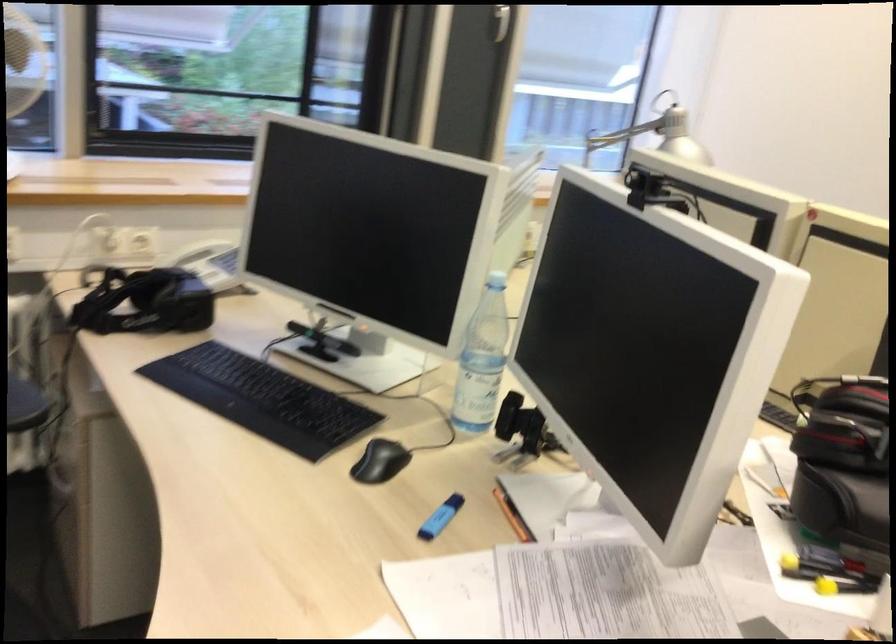
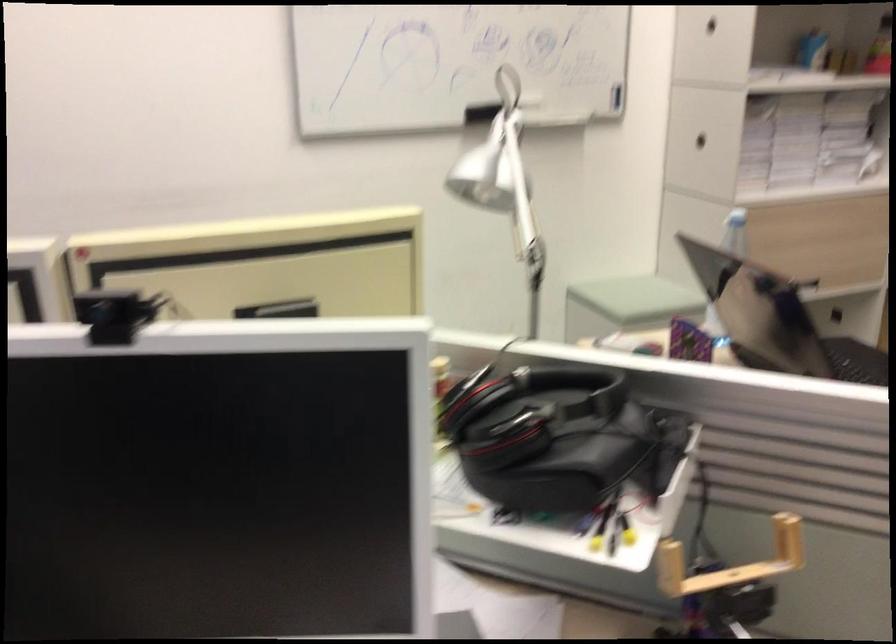
First-person continuous shooting, in which direction is the camera rotating?

The rotation direction of the camera is right-down.